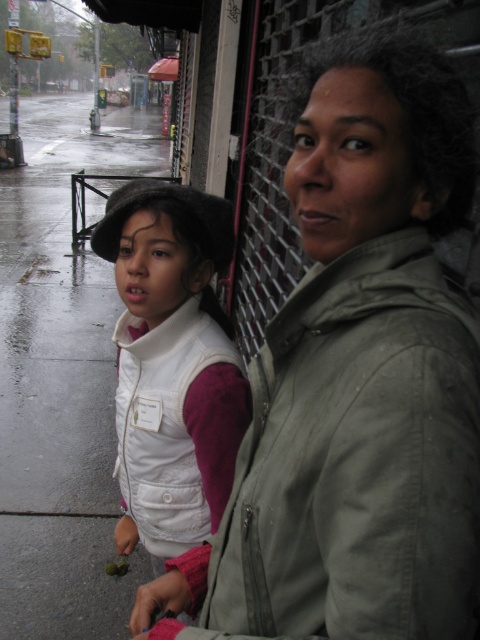
Question: Is wet asphalt sidewalk at left behind white matte vest at center?

Choices:
 (A) no
 (B) yes

Answer: (B)

Question: Which point appears closest to the camera in this image?

Choices:
 (A) (177, 220)
 (B) (67, 486)

Answer: (A)

Question: Is wet asphalt sidewalk at left smaller than white matte vest at center?

Choices:
 (A) no
 (B) yes

Answer: (A)

Question: Does wet asphalt sidewalk at left have a lesser width compared to white matte vest at center?

Choices:
 (A) no
 (B) yes

Answer: (A)

Question: Which object is farther from the camera taking this photo?

Choices:
 (A) green matte jacket at center
 (B) white matte vest at center
 (C) wet asphalt sidewalk at left

Answer: (C)

Question: Which point appears closest to the camera in this image?

Choices:
 (A) (62, 634)
 (B) (179, 198)
 (C) (456, 404)

Answer: (C)